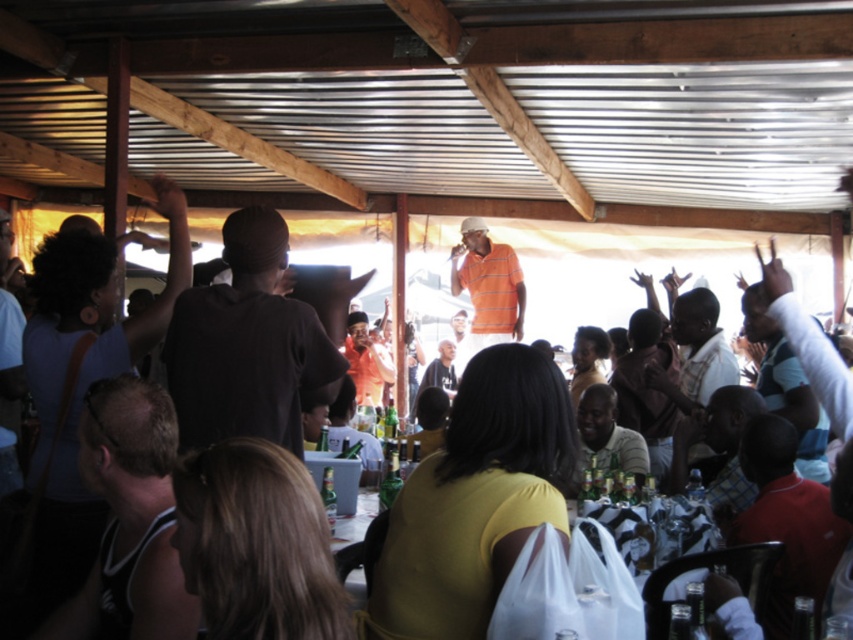
Is plaid shirt at center to the left of red shirt at lower right from the viewer's perspective?

No, plaid shirt at center is not to the left of red shirt at lower right.

Measure the distance between point (711, 336) and camera.

Point (711, 336) is 14.12 feet away from camera.

Locate an element on the screen. The height and width of the screenshot is (640, 853). plaid shirt at center is located at coordinates (695, 353).

Does dark brown hair at lower left have a lesser width compared to orange striped polo shirt at center?

Correct, dark brown hair at lower left's width is less than orange striped polo shirt at center's.

Between point (115, 419) and point (490, 282), which one is positioned in front?

Point (115, 419) is in front.

You are a GUI agent. You are given a task and a screenshot of the screen. Output one action in this format:
    pyautogui.click(x=<x>, y=<y>)
    Task: Click on the dark brown hair at lower left
    The image size is (853, 640).
    Given the screenshot: What is the action you would take?
    pyautogui.click(x=129, y=518)

This screenshot has height=640, width=853. Describe the element at coordinates (695, 353) in the screenshot. I see `plaid shirt at center` at that location.

Is plaid shirt at center bigger than matte gray shirt at center?

Yes.

Which is in front, point (715, 324) or point (599, 438)?

Positioned in front is point (715, 324).

You are a GUI agent. You are given a task and a screenshot of the screen. Output one action in this format:
    pyautogui.click(x=<x>, y=<y>)
    Task: Click on the plaid shirt at center
    
    Given the screenshot: What is the action you would take?
    tap(695, 353)